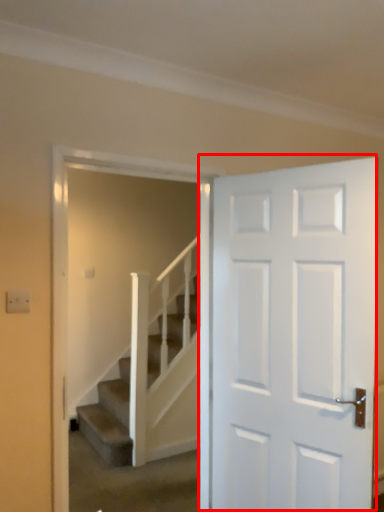
Question: Where is door (annotated by the red box) located in relation to stairs in the image?

Choices:
 (A) right
 (B) left

Answer: (A)